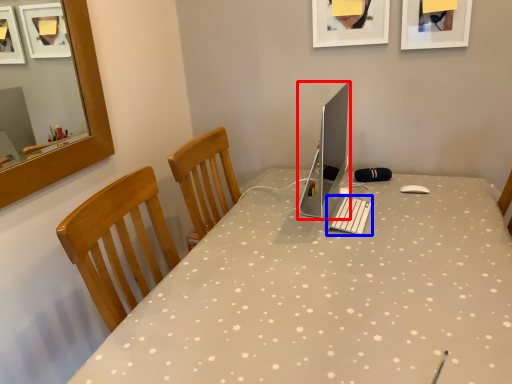
Question: Which of the following is the farthest to the observer, computer monitor (highlighted by a red box) or laptop keyboard (highlighted by a blue box)?

Choices:
 (A) computer monitor
 (B) laptop keyboard

Answer: (B)